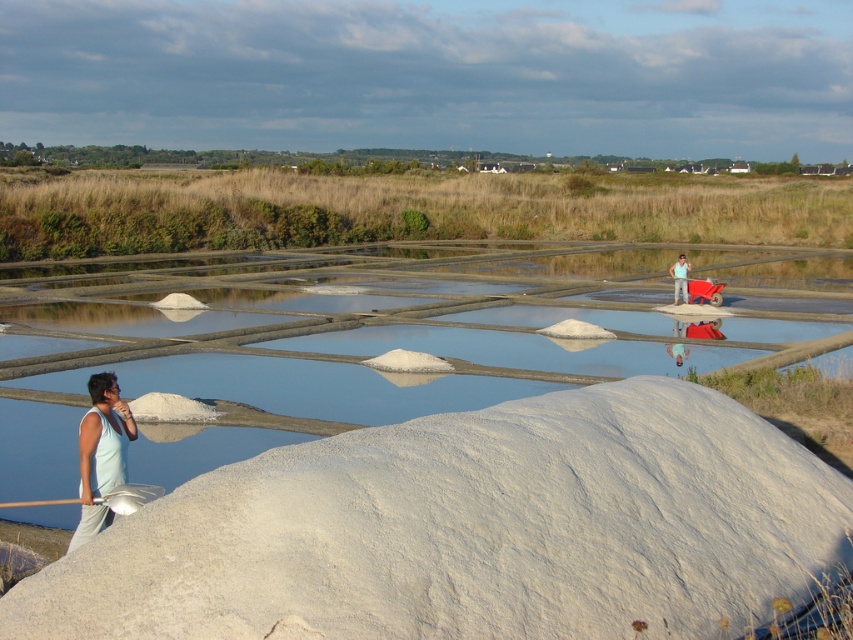
In the scene shown: Does white powdery cement at lower center have a lesser height compared to clear water at center?

Correct, white powdery cement at lower center is not as tall as clear water at center.

Who is shorter, white powdery cement at lower center or clear water at center?

white powdery cement at lower center is shorter.

Is point (846, 531) positioned after point (347, 388)?

No, it is not.

This screenshot has height=640, width=853. What are the coordinates of `white powdery cement at lower center` in the screenshot? It's located at pos(471,529).

What do you see at coordinates (102, 452) in the screenshot? Image resolution: width=853 pixels, height=640 pixels. I see `light blue tank top at left` at bounding box center [102, 452].

Is point (86, 387) behind point (680, 282)?

No, it is in front of (680, 282).

The height and width of the screenshot is (640, 853). Describe the element at coordinates (102, 452) in the screenshot. I see `light blue tank top at left` at that location.

Where is `light blue tank top at left`? This screenshot has width=853, height=640. light blue tank top at left is located at coordinates (102, 452).

Looking at this image, between green grassland at upper center and light blue tank top at left, which one appears on the left side from the viewer's perspective?

light blue tank top at left is more to the left.

Can you confirm if green grassland at upper center is positioned below light blue tank top at left?

No, green grassland at upper center is not below light blue tank top at left.

Which is behind, point (297, 189) or point (102, 412)?

Positioned behind is point (297, 189).

In order to click on green grassland at upper center in this screenshot , I will do tap(407, 211).